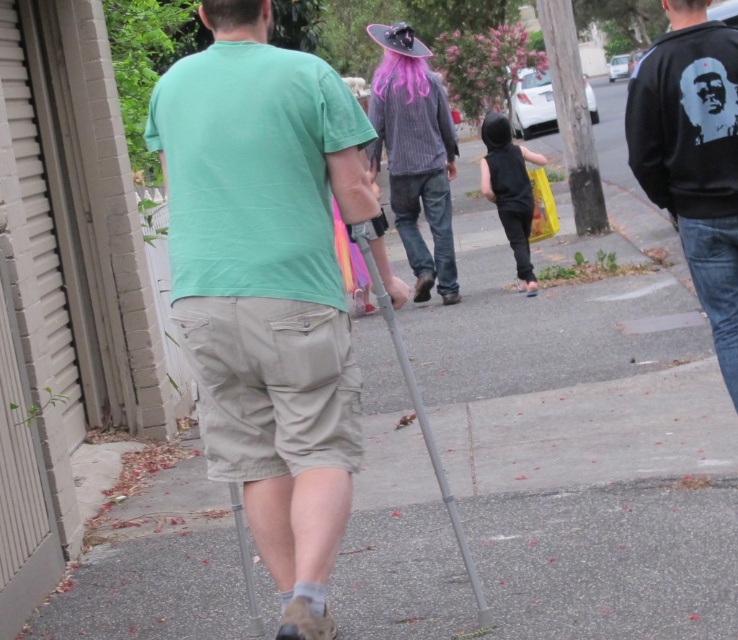
Question: In this image, where is striped fabric shirt at center located relative to black matte vest at center?

Choices:
 (A) left
 (B) right

Answer: (A)

Question: Which object is farther from the camera taking this photo?

Choices:
 (A) pink silky hair at upper center
 (B) green matte t-shirt at center
 (C) wooden pole at upper right

Answer: (C)

Question: Does green matte t-shirt at center appear over metallic gray crutch at lower center?

Choices:
 (A) no
 (B) yes

Answer: (B)

Question: Can you confirm if black matte vest at center is positioned to the left of pink silky hair at upper center?

Choices:
 (A) no
 (B) yes

Answer: (A)

Question: Which object is the farthest from the striped fabric shirt at center?

Choices:
 (A) green matte t-shirt at center
 (B) gray metallic crutch at center
 (C) wooden pole at upper right

Answer: (A)

Question: Which object is positioned closest to the green matte t-shirt at center?

Choices:
 (A) black matte vest at center
 (B) striped fabric shirt at center

Answer: (B)